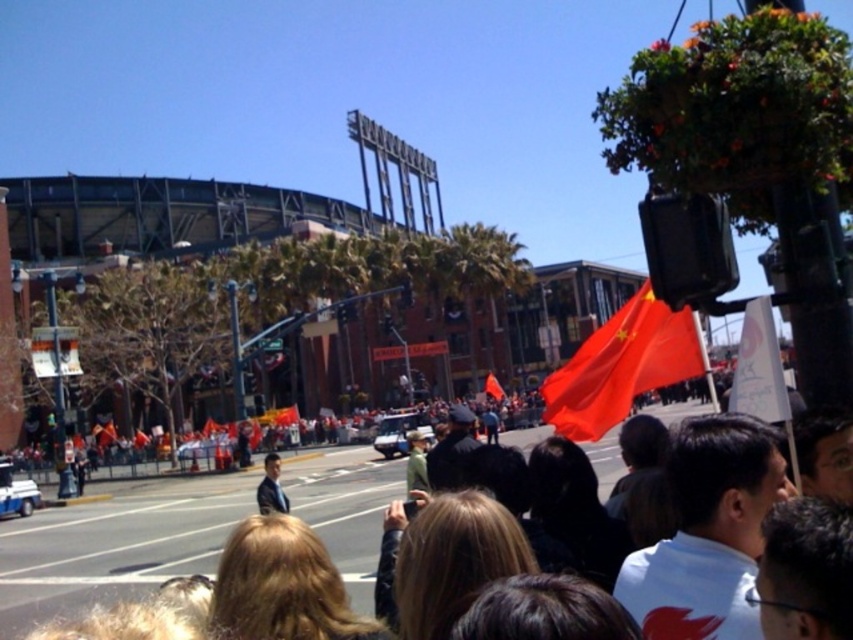
Between white cotton shirt at center and white paper sign at upper right, which one is positioned lower?

white cotton shirt at center is below.

Is point (352, 451) farther from camera compared to point (785, 390)?

Yes.

Locate an element on the screen. The image size is (853, 640). white cotton shirt at center is located at coordinates (115, 545).

Between white cotton shirt at center and red fabric flag at center, which one is positioned higher?

red fabric flag at center

Is white cotton shirt at center shorter than red fabric flag at center?

Incorrect, white cotton shirt at center's height does not fall short of red fabric flag at center's.

The height and width of the screenshot is (640, 853). Describe the element at coordinates (115, 545) in the screenshot. I see `white cotton shirt at center` at that location.

You are a GUI agent. You are given a task and a screenshot of the screen. Output one action in this format:
    pyautogui.click(x=<x>, y=<y>)
    Task: Click on the white cotton shirt at center
    This screenshot has width=853, height=640.
    Given the screenshot: What is the action you would take?
    pyautogui.click(x=115, y=545)

Does white cotton shirt at center have a lesser width compared to white matte shirt at center?

No, white cotton shirt at center is not thinner than white matte shirt at center.

From the picture: Who is shorter, white cotton shirt at center or white matte shirt at center?

Standing shorter between the two is white matte shirt at center.

Who is more distant from viewer, (x=369, y=608) or (x=691, y=467)?

The point (x=369, y=608) is behind.

Locate an element on the screen. This screenshot has width=853, height=640. white cotton shirt at center is located at coordinates pyautogui.click(x=115, y=545).